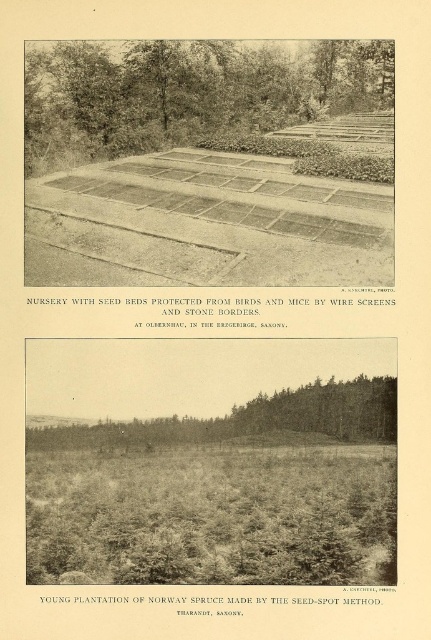
You are a forester planning to transport saplings from the nursery to the planting site. You notice the brown gravel dirt track at center and the green leafy tree at upper center. Which of these two features occupies a larger area in the top panel?

The green leafy tree at upper center occupies a larger area than the brown gravel dirt track at center in the top panel.